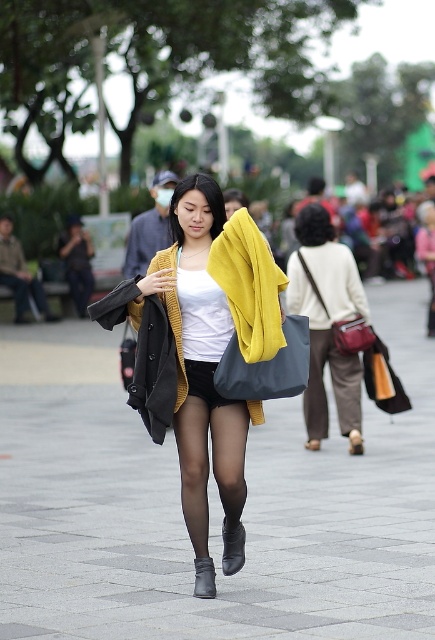
Where is `brown fabric pants at lower center`? brown fabric pants at lower center is located at coordinates (333, 387).

At what (x,y) coordinates should I click in order to perform the action: click on brown fabric pants at lower center. Please return your answer as a coordinate pair (x, y). Looking at the image, I should click on (333, 387).

Does gray concrete pavement at center have a greater height compared to leather boot at center?

Yes.

Which is in front, point (89, 544) or point (194, 582)?

Positioned in front is point (194, 582).

Find the location of a particular element. gray concrete pavement at center is located at coordinates (210, 506).

Who is higher up, matte brown bag at center or yellow woolen sweater at center?

yellow woolen sweater at center is higher up.

The height and width of the screenshot is (640, 435). Describe the element at coordinates (327, 324) in the screenshot. I see `matte brown bag at center` at that location.

Locate an element on the screen. This screenshot has width=435, height=640. matte brown bag at center is located at coordinates (327, 324).